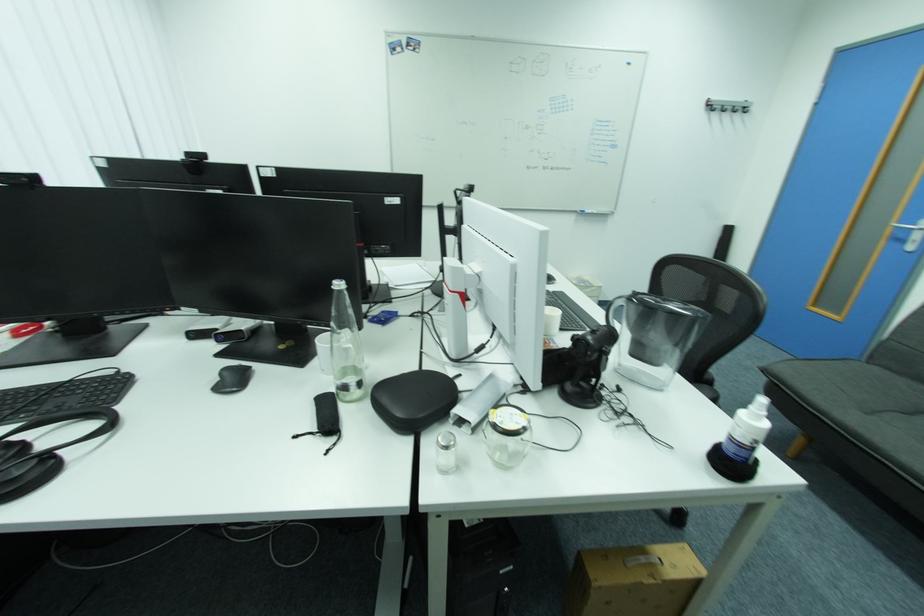
Locate an element on the screen. Image resolution: width=924 pixels, height=616 pixels. empty glass jar is located at coordinates (506, 436).